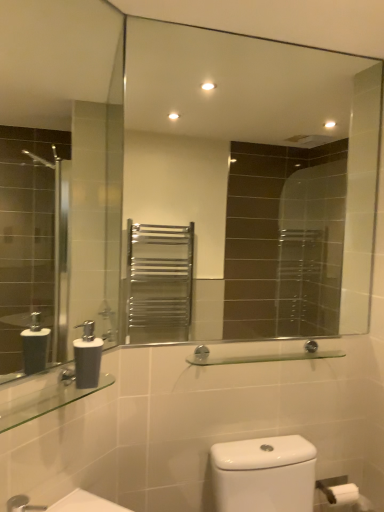
Question: Is clear glass shelf at center, which ranks as the 2th balustrade in front-to-back order, completely or partially inside matte gray soap dispenser at lower left?

Choices:
 (A) no
 (B) yes

Answer: (A)

Question: Is matte gray soap dispenser at lower left positioned in front of clear glass shelf at center, which ranks as the 2th balustrade in front-to-back order?

Choices:
 (A) yes
 (B) no

Answer: (A)

Question: Is matte gray soap dispenser at lower left outside clear glass shelf at center, placed as the second balustrade when sorted from left to right?

Choices:
 (A) yes
 (B) no

Answer: (A)

Question: Can you confirm if matte gray soap dispenser at lower left is wider than clear glass shelf at center, placed as the second balustrade when sorted from left to right?

Choices:
 (A) yes
 (B) no

Answer: (A)

Question: From the image's perspective, would you say matte gray soap dispenser at lower left is shown under clear glass shelf at center, placed as the second balustrade when sorted from left to right?

Choices:
 (A) no
 (B) yes

Answer: (A)

Question: Is matte gray soap dispenser at lower left thinner than clear glass shelf at center, which ranks as the 2th balustrade in front-to-back order?

Choices:
 (A) yes
 (B) no

Answer: (B)

Question: Can clear glass shelf at lower left, arranged as the 1th balustrade when viewed from the front, be found inside clear glass shelf at center, placed as the second balustrade when sorted from left to right?

Choices:
 (A) yes
 (B) no

Answer: (B)

Question: From a real-world perspective, is clear glass shelf at center, the first balustrade viewed from the back, below clear glass shelf at lower left, arranged as the 1th balustrade when viewed from the front?

Choices:
 (A) yes
 (B) no

Answer: (B)

Question: Does clear glass shelf at center, arranged as the 1th balustrade when viewed from the right, have a larger size compared to clear glass shelf at lower left, the 1th balustrade in the left-to-right sequence?

Choices:
 (A) no
 (B) yes

Answer: (B)

Question: Does clear glass shelf at center, arranged as the 1th balustrade when viewed from the right, have a lesser width compared to clear glass shelf at lower left, the 1th balustrade in the left-to-right sequence?

Choices:
 (A) no
 (B) yes

Answer: (B)

Question: Can we say clear glass shelf at center, the first balustrade viewed from the back, lies outside clear glass shelf at lower left, the 1th balustrade in the left-to-right sequence?

Choices:
 (A) yes
 (B) no

Answer: (A)

Question: Does clear glass shelf at center, placed as the second balustrade when sorted from left to right, appear on the right side of clear glass shelf at lower left, the 1th balustrade in the left-to-right sequence?

Choices:
 (A) yes
 (B) no

Answer: (A)

Question: Is clear glass shelf at lower left, arranged as the 1th balustrade when viewed from the front, inside matte gray soap dispenser at lower left?

Choices:
 (A) yes
 (B) no

Answer: (B)